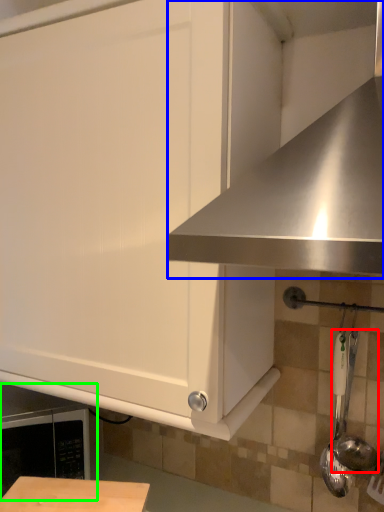
Question: Which object is positioned farthest from utensil (highlighted by a red box)? Select from exhaust hood (highlighted by a blue box) and appliance (highlighted by a green box).

Choices:
 (A) exhaust hood
 (B) appliance

Answer: (B)